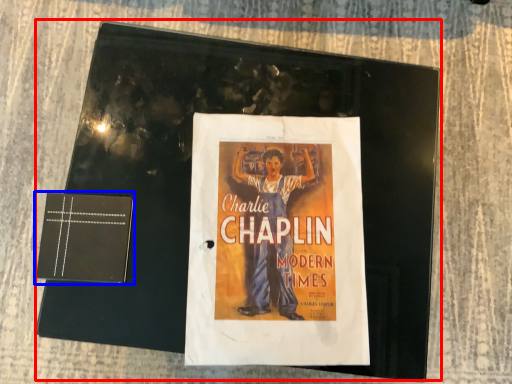
Question: Which object appears farthest to the camera in this image, magazine (highlighted by a red box) or paperback book (highlighted by a blue box)?

Choices:
 (A) magazine
 (B) paperback book

Answer: (A)